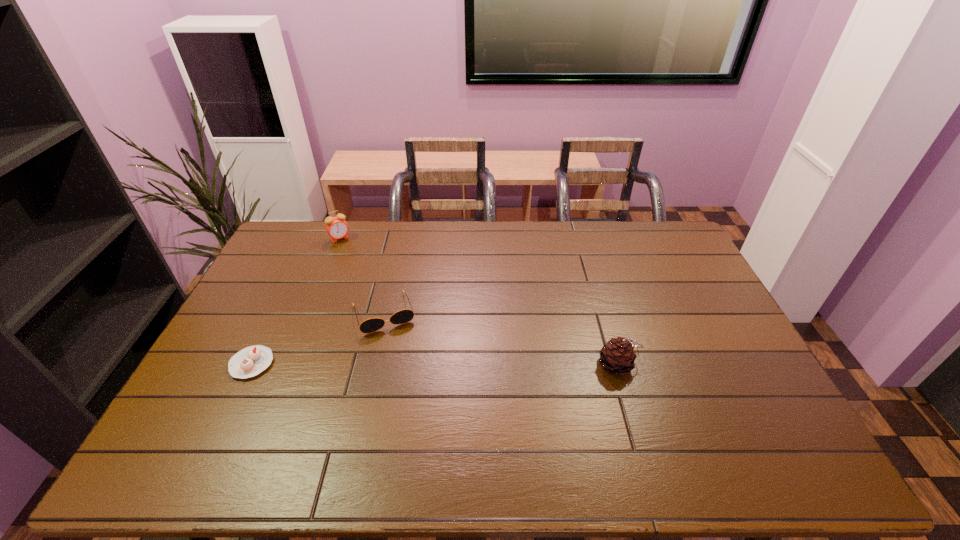
Locate an element on the screen. This screenshot has width=960, height=540. free location at the far left corner of the desktop is located at coordinates (301, 247).

Locate an element on the screen. vacant point at the far right corner is located at coordinates (652, 235).

Find the location of a particular element. free space between the cupcake and the rightmost object is located at coordinates (436, 364).

Where is `free area in between the alarm clock and the shortest object`? The height and width of the screenshot is (540, 960). free area in between the alarm clock and the shortest object is located at coordinates (296, 301).

Locate an element on the screen. vacant point located between the leftmost object and the alarm clock is located at coordinates (296, 301).

Where is `blank region between the pinecone and the alarm clock`? This screenshot has width=960, height=540. blank region between the pinecone and the alarm clock is located at coordinates (480, 301).

At what (x,y) coordinates should I click in order to perform the action: click on free spot between the pinecone and the farthest object. Please return your answer as a coordinate pair (x, y). The width and height of the screenshot is (960, 540). Looking at the image, I should click on (x=480, y=301).

Image resolution: width=960 pixels, height=540 pixels. I want to click on unoccupied area between the third tallest object and the alarm clock, so click(x=362, y=275).

Locate an element on the screen. This screenshot has height=540, width=960. unoccupied area between the shortest object and the rightmost object is located at coordinates (436, 364).

In order to click on unoccupied area between the alarm clock and the second object from right to left in this screenshot , I will do `click(362, 275)`.